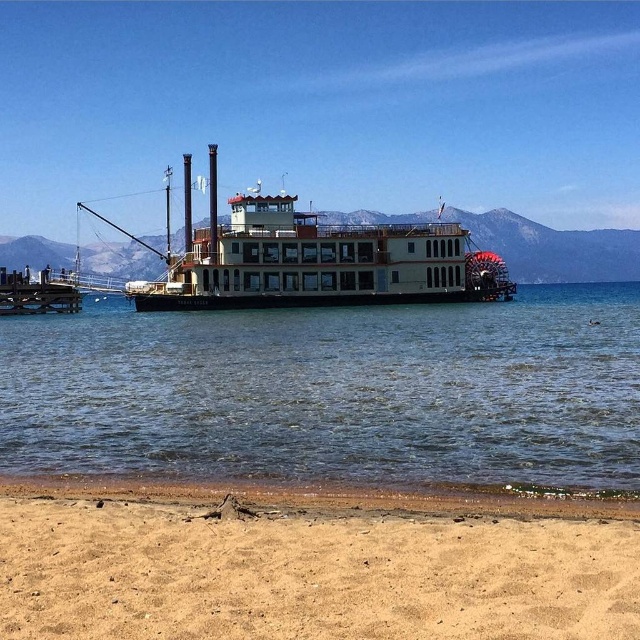
Can you confirm if clear blue water at center is shorter than tan sandy beach at lower center?

No, clear blue water at center is not shorter than tan sandy beach at lower center.

The height and width of the screenshot is (640, 640). In order to click on clear blue water at center in this screenshot , I will do `click(333, 392)`.

Between point (282, 454) and point (512, 604), which one is positioned in front?

Point (512, 604) is in front.

Where is `clear blue water at center`? clear blue water at center is located at coordinates (333, 392).

In the scene shown: Which is more to the right, tan sandy beach at lower center or white wooden paddlewheel boat at center?

From the viewer's perspective, tan sandy beach at lower center appears more on the right side.

Does tan sandy beach at lower center have a lesser height compared to white wooden paddlewheel boat at center?

Indeed, tan sandy beach at lower center has a lesser height compared to white wooden paddlewheel boat at center.

Who is more forward, (276, 605) or (413, 291)?

Point (276, 605) is more forward.

You are a GUI agent. You are given a task and a screenshot of the screen. Output one action in this format:
    pyautogui.click(x=<x>, y=<y>)
    Task: Click on the tan sandy beach at lower center
    The image size is (640, 640).
    Given the screenshot: What is the action you would take?
    pyautogui.click(x=308, y=573)

Does clear blue water at center have a greater height compared to wooden dock at center?

No, clear blue water at center is not taller than wooden dock at center.

Is clear blue water at center smaller than wooden dock at center?

Yes, clear blue water at center is smaller than wooden dock at center.

You are a GUI agent. You are given a task and a screenshot of the screen. Output one action in this format:
    pyautogui.click(x=<x>, y=<y>)
    Task: Click on the clear blue water at center
    
    Given the screenshot: What is the action you would take?
    pyautogui.click(x=333, y=392)